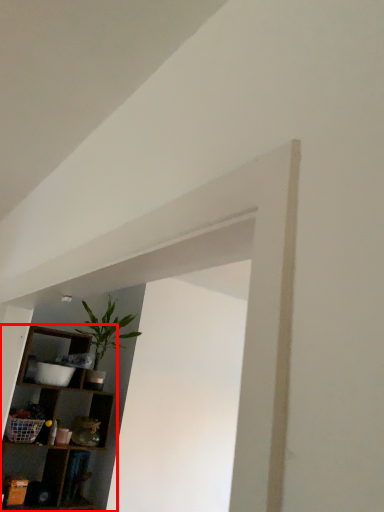
Question: From the image's perspective, what is the correct spatial positioning of shelf (annotated by the red box) in reference to houseplant?

Choices:
 (A) below
 (B) above

Answer: (A)